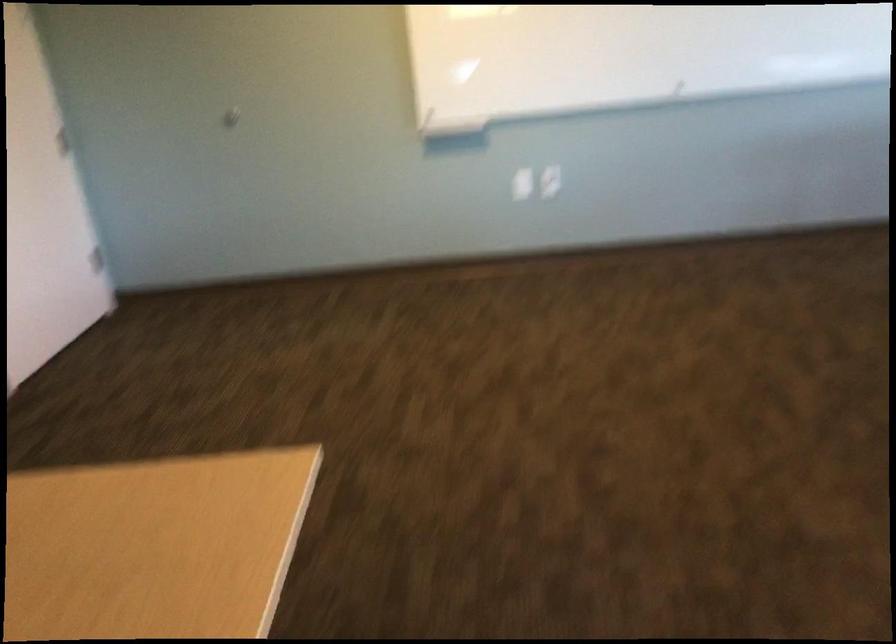
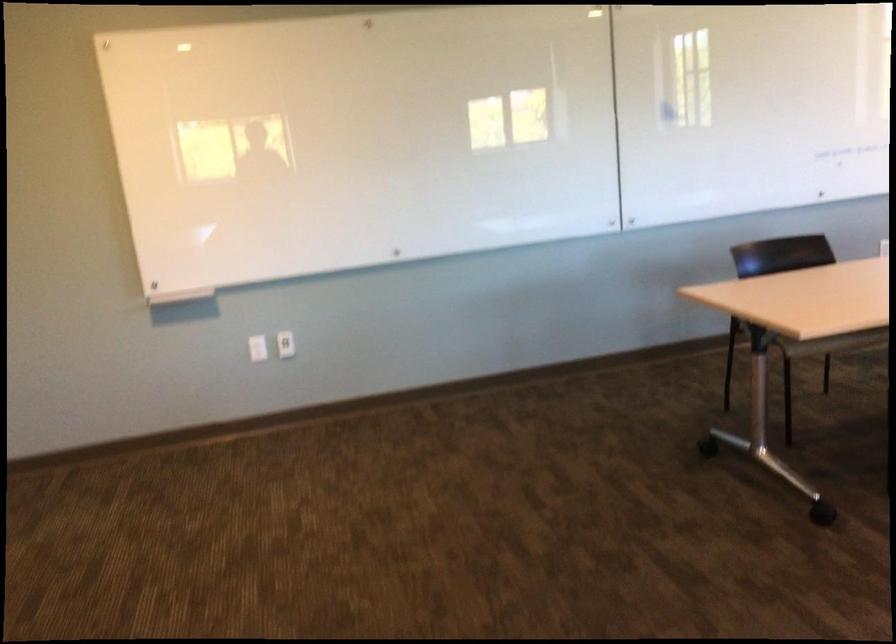
Find the pixel in the second image that matches (443,124) in the first image.

(175, 292)